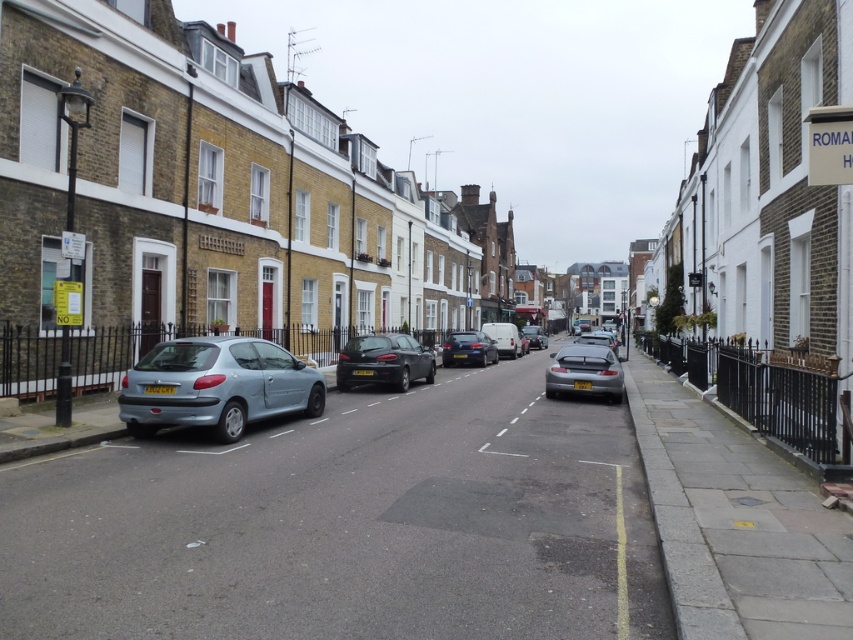
Question: Is satin silver hatchback at left to the right of satin silver car at center from the viewer's perspective?

Choices:
 (A) yes
 (B) no

Answer: (B)

Question: Which object appears farthest from the camera in this image?

Choices:
 (A) white matte van at center
 (B) matte silver car at center
 (C) shiny black car at center

Answer: (B)

Question: Can you confirm if shiny black car at center is bigger than white matte van at center?

Choices:
 (A) yes
 (B) no

Answer: (B)

Question: Among these points, which one is farthest from the camera?

Choices:
 (A) (339, 355)
 (B) (583, 356)
 (C) (515, 333)

Answer: (C)

Question: Does glossy metallic car at center have a greater width compared to matte silver car at center?

Choices:
 (A) no
 (B) yes

Answer: (A)

Question: Which of the following is the closest to the observer?

Choices:
 (A) shiny black car at center
 (B) glossy metallic car at center

Answer: (A)